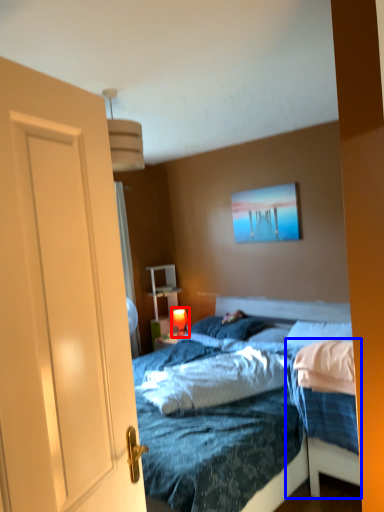
Question: Among these objects, which one is nearest to the camera, table lamp (highlighted by a red box) or bed frame (highlighted by a blue box)?

Choices:
 (A) table lamp
 (B) bed frame

Answer: (B)